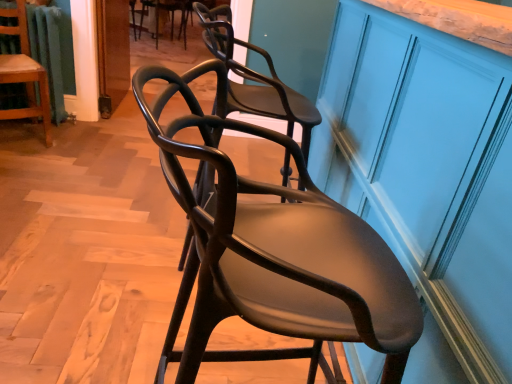
Question: In the image, is wooden chair at left, which appears as the second chair when viewed from the top, on the left side or the right side of matte dark wood chair at center, placed as the third chair when sorted from top to bottom?

Choices:
 (A) right
 (B) left

Answer: (B)

Question: Do you think wooden chair at left, which appears as the second chair when viewed from the top, is within matte dark wood chair at center, which appears as the 1th chair when ordered from the bottom, or outside of it?

Choices:
 (A) outside
 (B) inside

Answer: (A)

Question: Which object is positioned closest to the matte blue cabinet at right?

Choices:
 (A) matte black chair at upper center, the 1th chair when ordered from back to front
 (B) matte dark wood chair at center, acting as the 3th chair starting from the left
 (C) wooden chair at left, placed as the third chair when sorted from right to left

Answer: (B)

Question: Which is nearer to the matte blue cabinet at right?

Choices:
 (A) matte black chair at upper center, the second chair when ordered from right to left
 (B) wooden chair at left, placed as the third chair when sorted from right to left
 (C) matte dark wood chair at center, which is the 3th chair in back-to-front order

Answer: (C)